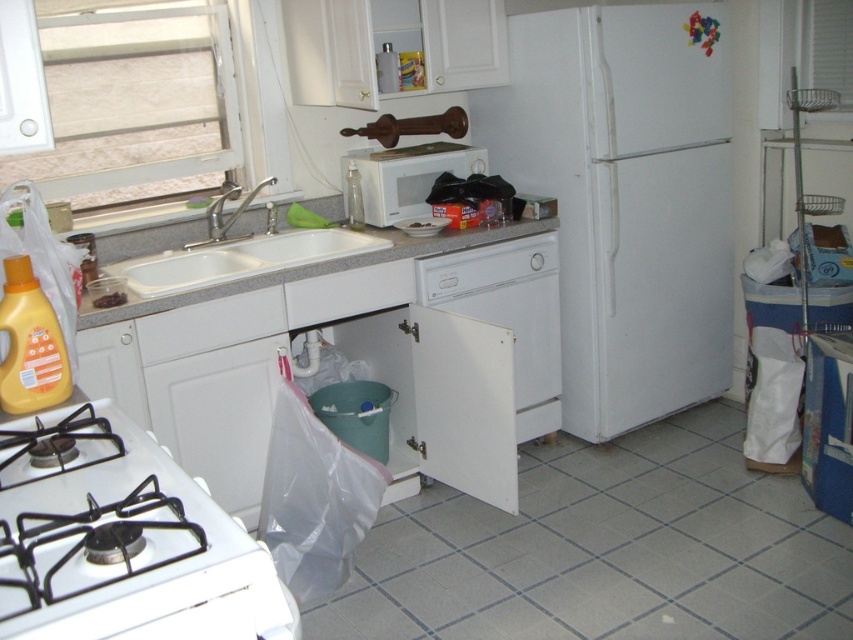
Can you confirm if gray granite countertop at center is positioned above white glossy sink at upper left?

Yes, gray granite countertop at center is above white glossy sink at upper left.

Which is below, gray granite countertop at center or white glossy sink at upper left?

white glossy sink at upper left is below.

I want to click on gray granite countertop at center, so click(318, 268).

Locate an element on the screen. gray granite countertop at center is located at coordinates (318, 268).

In the scene shown: Does white matte dishwasher at center have a larger size compared to gray granite countertop at center?

No.

Who is positioned more to the left, white matte dishwasher at center or gray granite countertop at center?

gray granite countertop at center is more to the left.

Describe the element at coordinates (508, 314) in the screenshot. I see `white matte dishwasher at center` at that location.

Where is `white matte dishwasher at center`? white matte dishwasher at center is located at coordinates (508, 314).

Does point (370, 230) come behind point (401, 154)?

No, it is not.

Does gray granite countertop at center have a greater height compared to white matte microwave at center?

No, gray granite countertop at center is not taller than white matte microwave at center.

What do you see at coordinates (318, 268) in the screenshot?
I see `gray granite countertop at center` at bounding box center [318, 268].

I want to click on gray granite countertop at center, so click(318, 268).